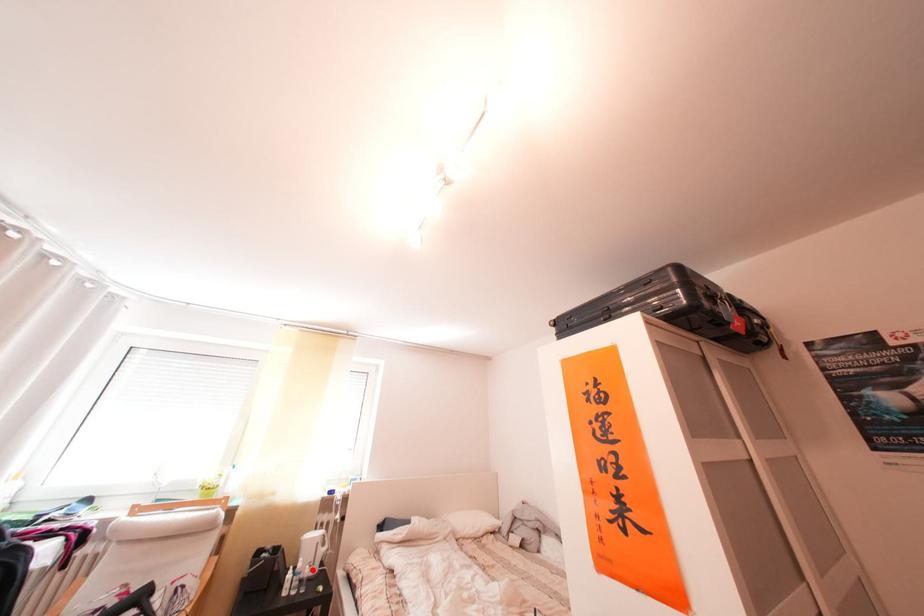
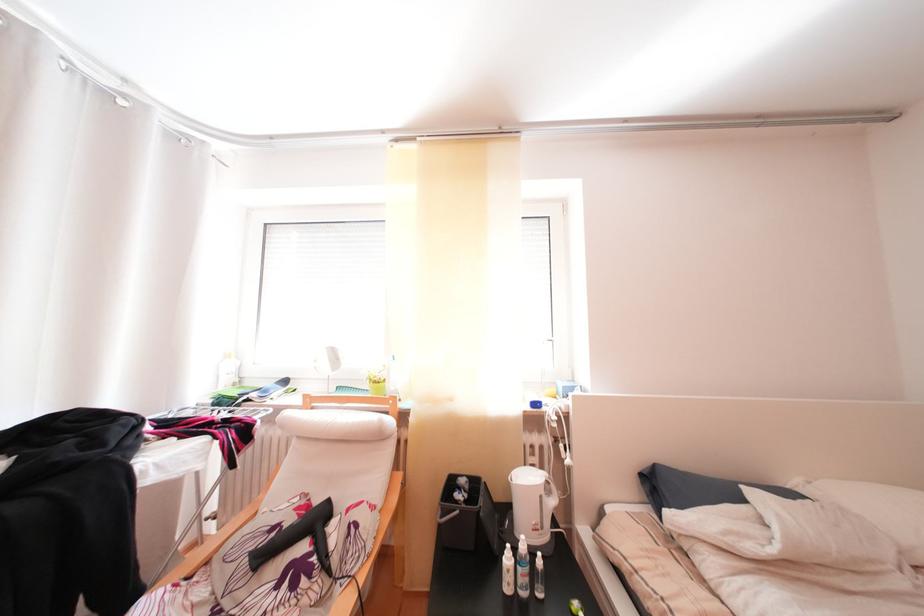
The point at the highlighted location is marked in the first image. Where is the corresponding point in the second image?

(536, 553)